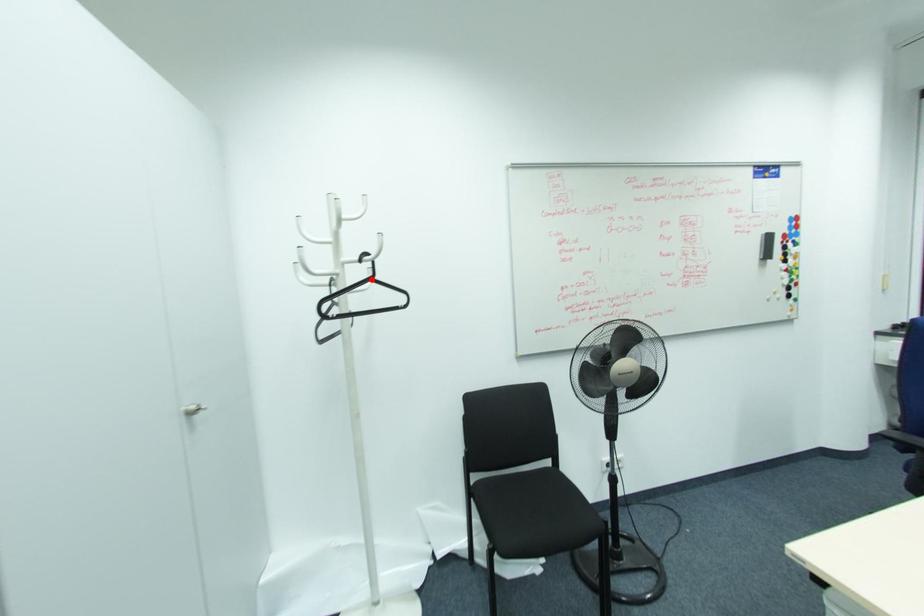
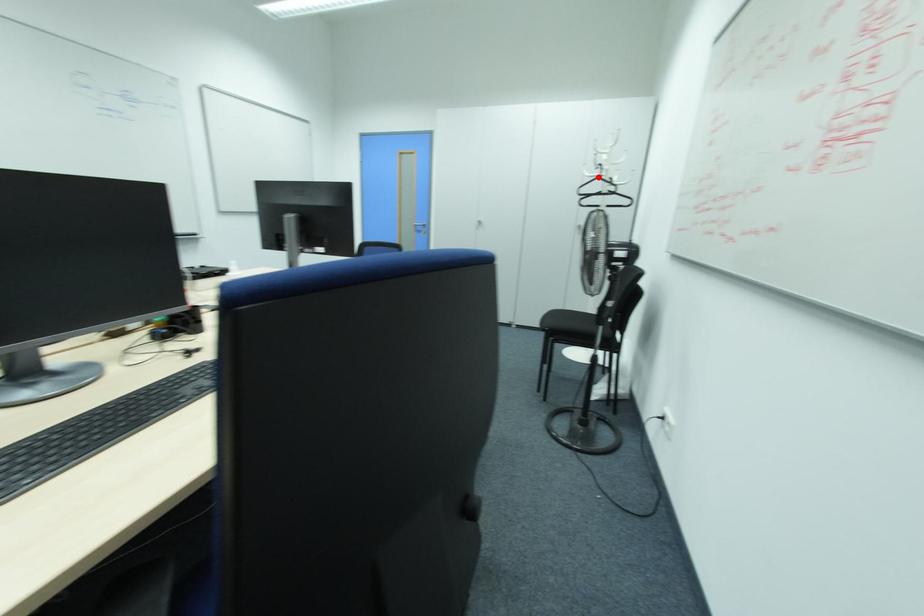
I am providing you with two images of the same scene from different viewpoints. A red point is marked on the first image and another point is marked on the second image. Are the points marked in image1 and image2 representing the same 3D position?

Yes